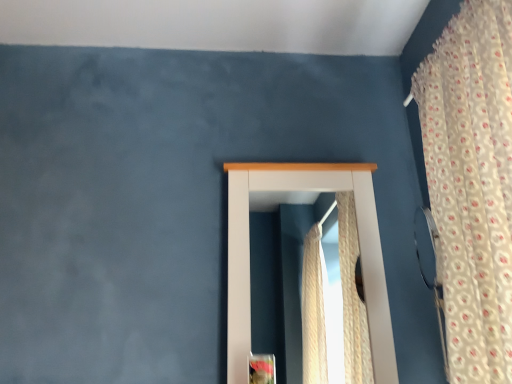
Question: In the image, is white wooden window at center positioned in front of or behind floral fabric curtain at right?

Choices:
 (A) behind
 (B) front

Answer: (A)

Question: In terms of size, does white wooden window at center appear bigger or smaller than floral fabric curtain at right?

Choices:
 (A) small
 (B) big

Answer: (A)

Question: Considering the positions of white wooden window at center and floral fabric curtain at right in the image, is white wooden window at center taller or shorter than floral fabric curtain at right?

Choices:
 (A) short
 (B) tall

Answer: (A)

Question: In the image, is floral fabric curtain at right positioned in front of or behind white wooden window at center?

Choices:
 (A) behind
 (B) front

Answer: (B)

Question: From the image's perspective, relative to white wooden window at center, is floral fabric curtain at right above or below?

Choices:
 (A) below
 (B) above

Answer: (B)

Question: From a real-world perspective, is floral fabric curtain at right above or below white wooden window at center?

Choices:
 (A) below
 (B) above

Answer: (B)

Question: In terms of height, does floral fabric curtain at right look taller or shorter compared to white wooden window at center?

Choices:
 (A) short
 (B) tall

Answer: (B)